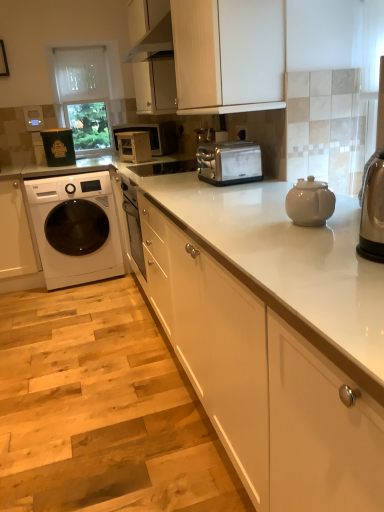
I want to click on free space above satin silver microwave at center, the first appliance viewed from the right (from a real-world perspective), so click(132, 133).